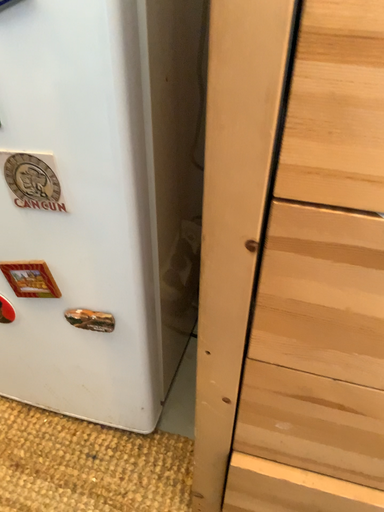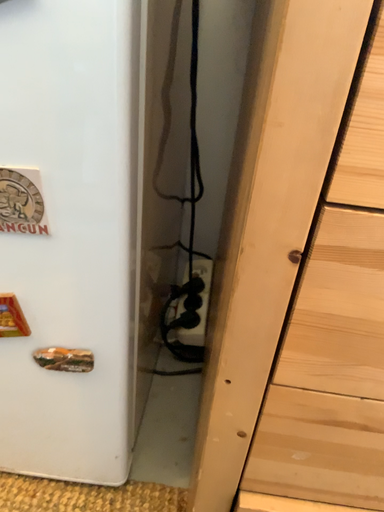
Question: How did the camera likely rotate when shooting the video?

Choices:
 (A) rotated right
 (B) rotated left

Answer: (A)